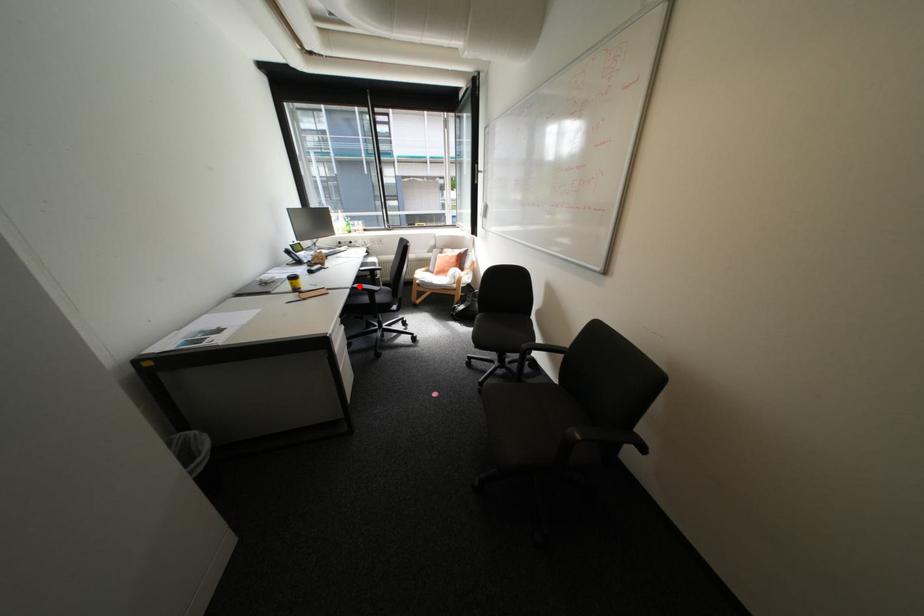
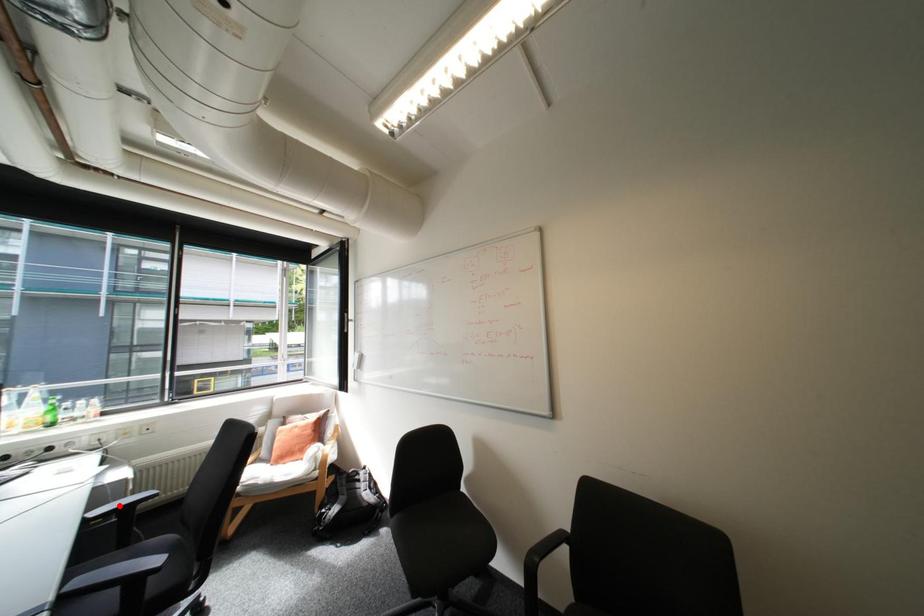
Consider the image. I am providing you with two images of the same scene from different viewpoints. A red point is marked on the first image and another point is marked on the second image. Is the red point in image1 aligned with the point shown in image2?

No